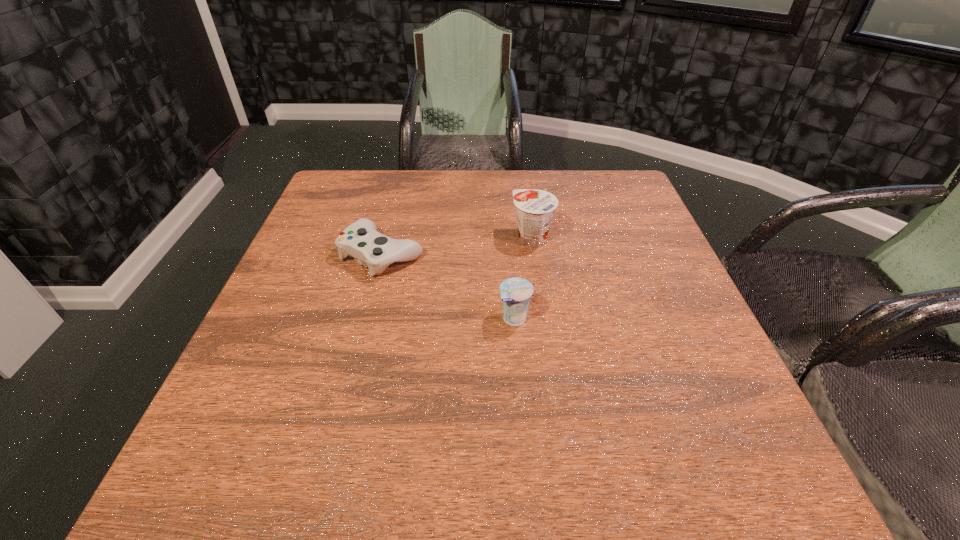
Locate an element on the screen. The width and height of the screenshot is (960, 540). vacant region between the tallest object and the control is located at coordinates (457, 246).

This screenshot has width=960, height=540. In order to click on free space between the second tallest object and the tallest object in this screenshot , I will do `click(523, 279)`.

You are a GUI agent. You are given a task and a screenshot of the screen. Output one action in this format:
    pyautogui.click(x=<x>, y=<y>)
    Task: Click on the vacant space in between the farther yogurt and the shortest object
    Image resolution: width=960 pixels, height=540 pixels.
    Given the screenshot: What is the action you would take?
    pyautogui.click(x=457, y=246)

Where is `free spot between the farther yogurt and the shortest object`? This screenshot has width=960, height=540. free spot between the farther yogurt and the shortest object is located at coordinates (457, 246).

The image size is (960, 540). I want to click on vacant area that lies between the farther yogurt and the nearest object, so click(x=523, y=279).

Image resolution: width=960 pixels, height=540 pixels. In order to click on unoccupied position between the shortest object and the shorter yogurt in this screenshot , I will do `click(448, 286)`.

This screenshot has width=960, height=540. In order to click on free spot between the tallest object and the leftmost object in this screenshot , I will do `click(457, 246)`.

The height and width of the screenshot is (540, 960). What are the coordinates of `the closest object to the tallest object` in the screenshot? It's located at (515, 292).

This screenshot has height=540, width=960. What are the coordinates of `the closest object to the tallest object` in the screenshot? It's located at (515, 292).

Find the location of a particular element. This screenshot has width=960, height=540. blank space that satisfies the following two spatial constraints: 1. on the back side of the tallest object; 2. on the right side of the shorter yogurt is located at coordinates (508, 239).